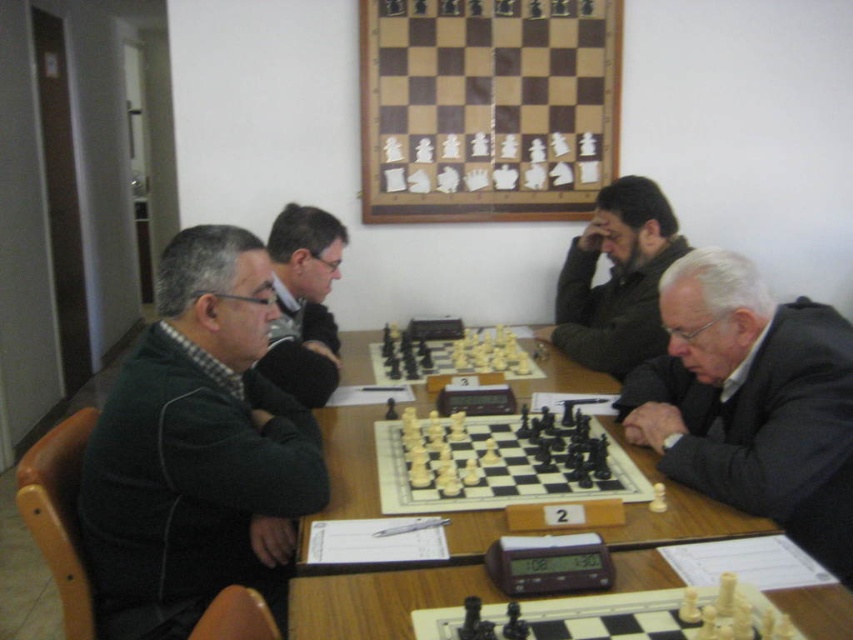
Question: Among these objects, which one is farthest from the camera?

Choices:
 (A) wooden chess set at center
 (B) wooden table at center

Answer: (A)

Question: Is white plastic chess pieces at center to the left of wooden chess set at center from the viewer's perspective?

Choices:
 (A) no
 (B) yes

Answer: (A)

Question: Can you confirm if dark green sweater at left is positioned below dark green jacket at center?

Choices:
 (A) no
 (B) yes

Answer: (B)

Question: Can you confirm if dark green jacket at center is smaller than wooden chess set at center?

Choices:
 (A) yes
 (B) no

Answer: (B)

Question: Which point appears closest to the camera in this image?

Choices:
 (A) (576, 336)
 (B) (102, 428)
 (C) (512, 348)
 (D) (413, 496)

Answer: (B)

Question: Estimate the real-world distances between objects in this image. Which object is closer to the dark green jacket at center?

Choices:
 (A) black wool suit at lower right
 (B) wooden chess set at center
 (C) matte black jacket at center

Answer: (B)